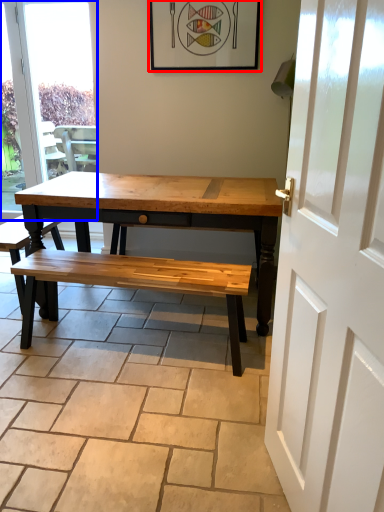
Question: Which object appears farthest to the camera in this image, picture frame (highlighted by a red box) or window (highlighted by a blue box)?

Choices:
 (A) picture frame
 (B) window

Answer: (B)